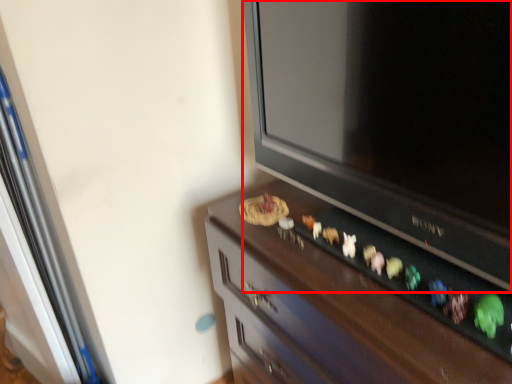
Question: From the image's perspective, what is the correct spatial positioning of television (annotated by the red box) in reference to furniture?

Choices:
 (A) above
 (B) below

Answer: (A)